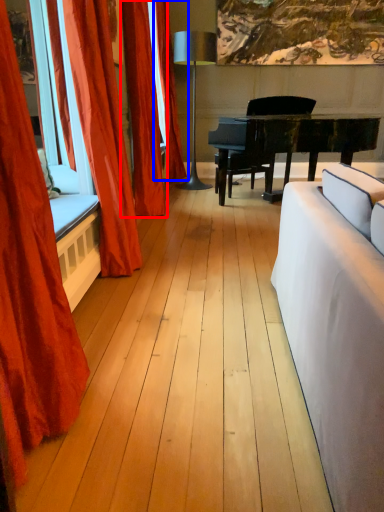
Question: Which point is closer to the camera, curtain (highlighted by a red box) or curtain (highlighted by a blue box)?

Choices:
 (A) curtain
 (B) curtain

Answer: (A)